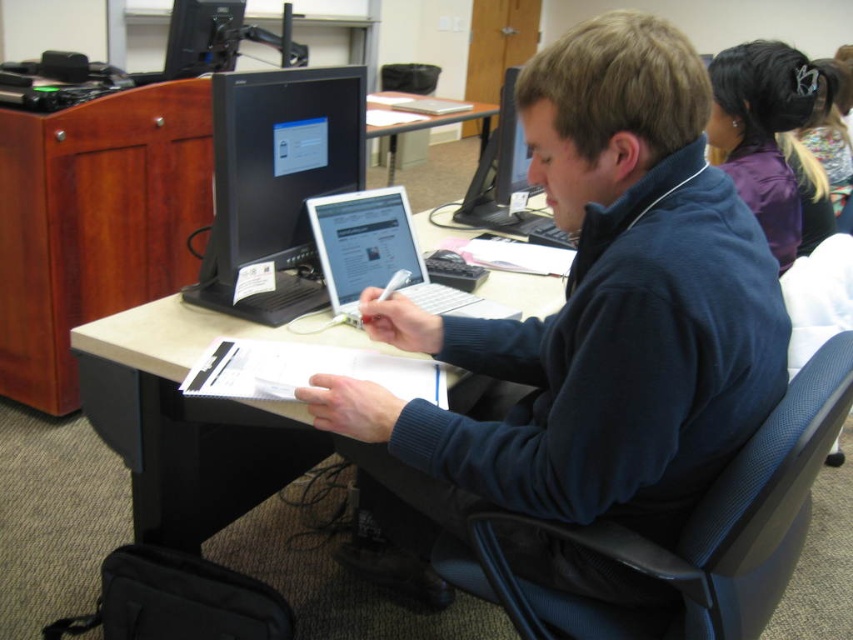
You are standing in the classroom and want to reach both points on the desk. Which point, point(260,93) or point(722,60), is closer to you?

Point(260,93) is closer to the viewer than point(722,60).

You are organizing a desk and need to place a new keyboard that requires more space than the black glossy monitor at center. Can the purple fabric hair tie at upper right provide enough space for the keyboard?

The black glossy monitor at center has a smaller width than the purple fabric hair tie at upper right. Since the keyboard needs more space than the monitor, the purple fabric hair tie at upper right may provide sufficient space for the keyboard.